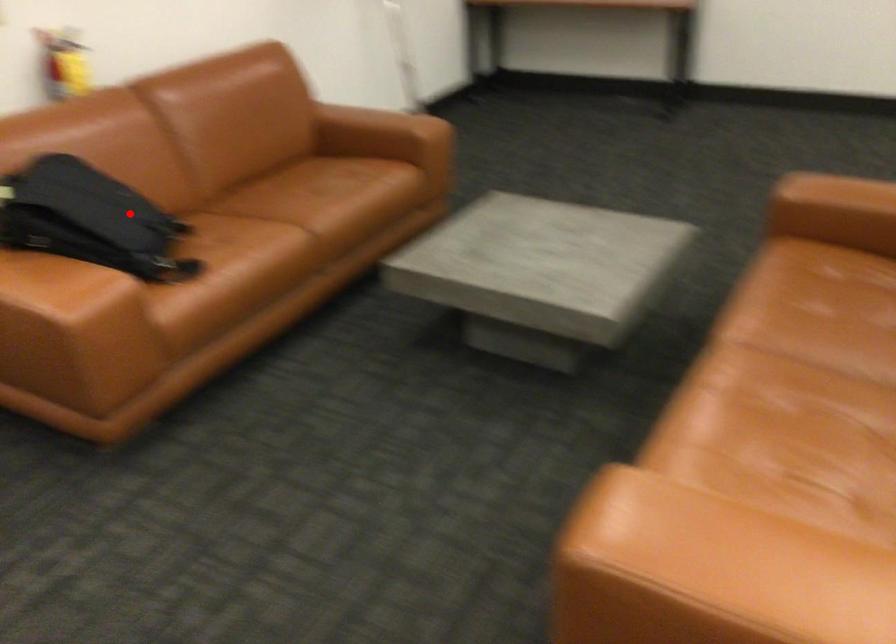
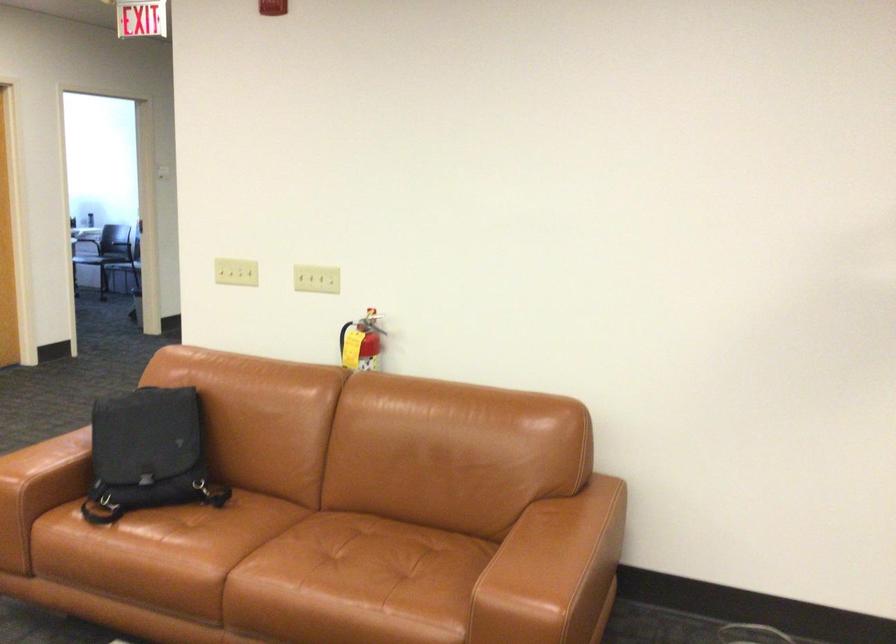
Where in the second image is the point corresponding to the highlighted location from the first image?

(148, 453)